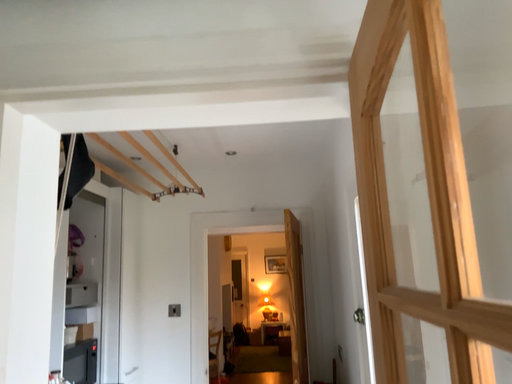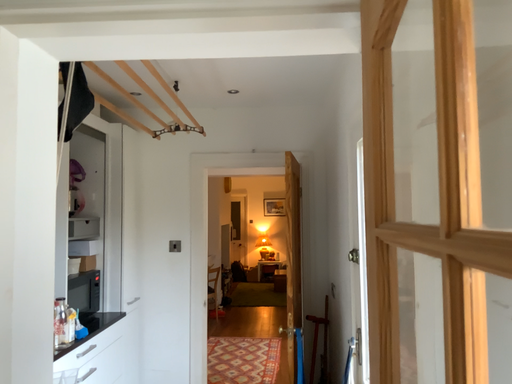
Question: How did the camera likely rotate when shooting the video?

Choices:
 (A) rotated upward
 (B) rotated downward

Answer: (B)